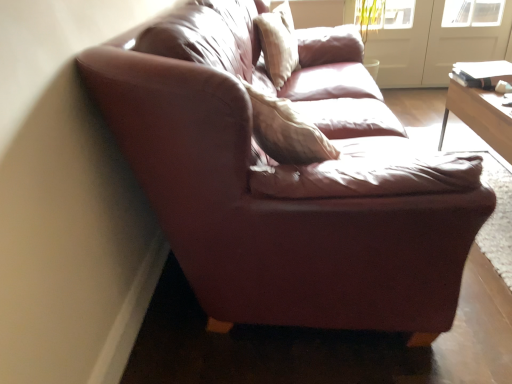
From a real-world perspective, find a few locations in the empty space that is ontop of transparent glass screen door at upper right, which is the second screen door from left to right. Your answer should be formatted as a list of tuples, i.e. [(x1, y1)], where each tuple contains the x and y coordinates of a point satisfying the conditions above.

[(0.929, -0.001)]